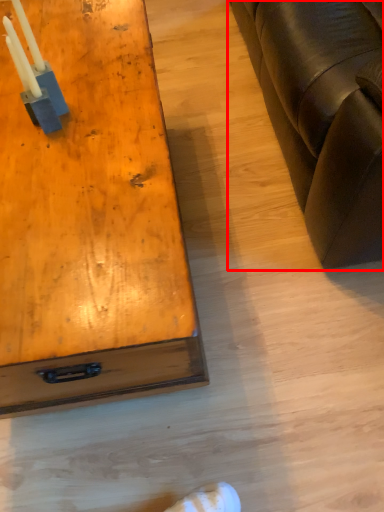
Question: From the image's perspective, what is the correct spatial relationship of studio couch (annotated by the red box) in relation to table?

Choices:
 (A) below
 (B) above

Answer: (B)